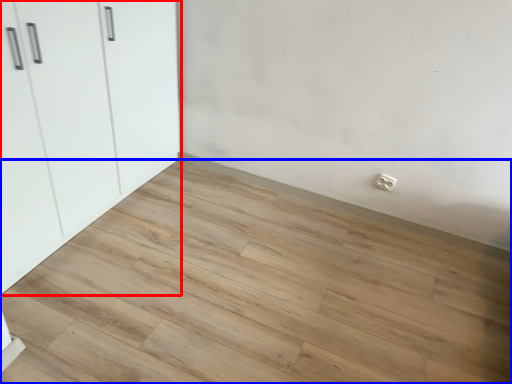
Question: Which of the following is the closest to the observer, cupboard (highlighted by a red box) or plank (highlighted by a blue box)?

Choices:
 (A) cupboard
 (B) plank

Answer: (B)